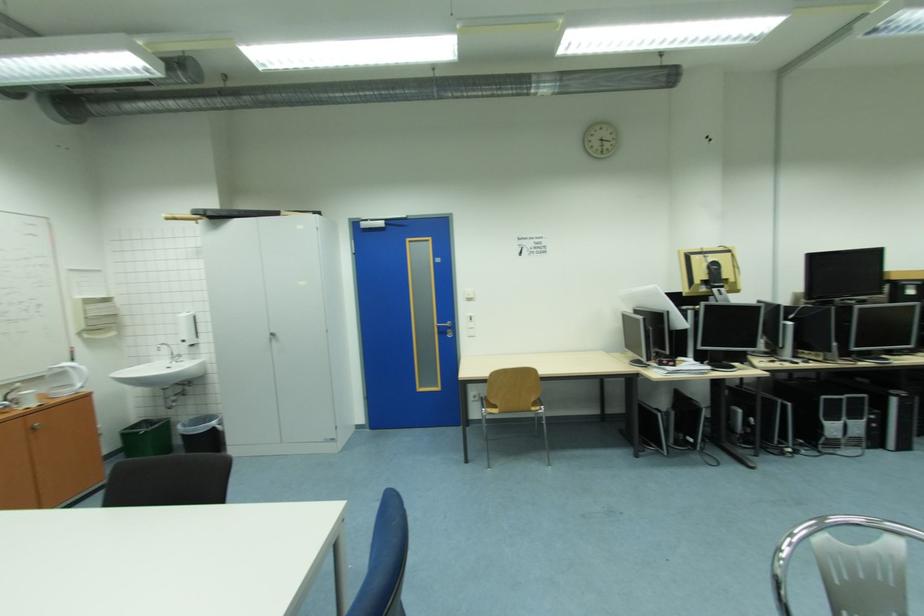
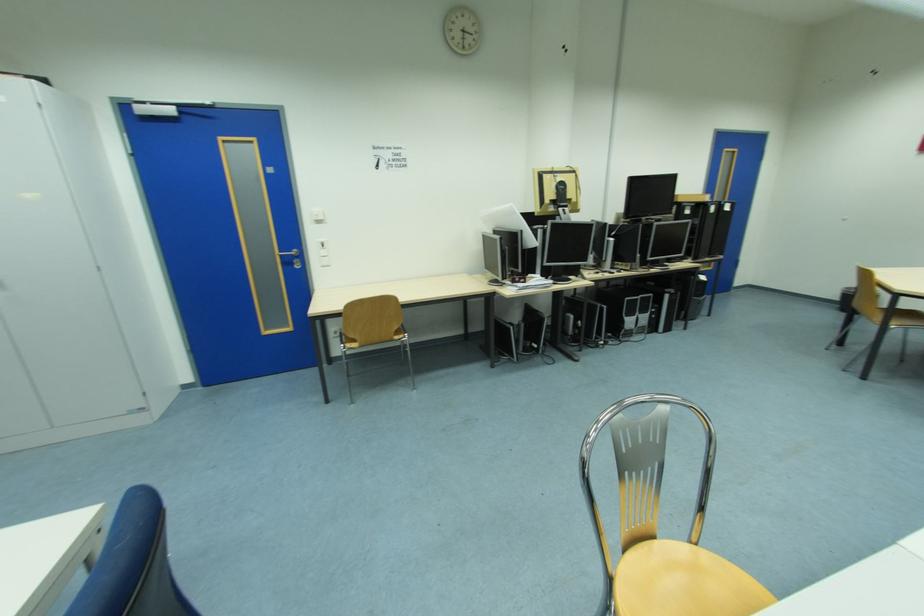
Question: How did the camera likely rotate?

Choices:
 (A) Left
 (B) Right
 (C) Up
 (D) Down

Answer: (B)